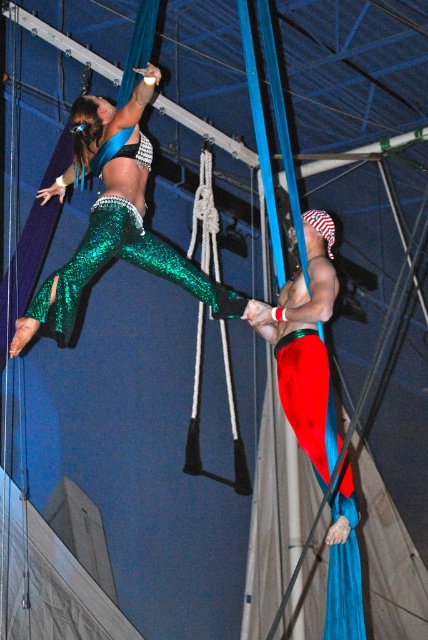
You are a photographer capturing the aerial performance. You notice the shiny green sequined pants at center and the red fabric pants at center. Which pair of pants appears to be higher in the image?

The shiny green sequined pants at center is positioned over red fabric pants at center, so it appears higher in the image.

You are a photographer capturing the aerial performance. You notice two performers wearing shiny green sequined pants at center and red fabric pants at center. Which performer is positioned to the left side of the other?

The shiny green sequined pants at center are to the left of the red fabric pants at center.

You are designing a new performance costume and need to ensure that the shiny green sequined pants at center and the red fabric pants at center can be easily distinguished from a distance. Based on the description provided, which pair of pants is wider?

The shiny green sequined pants at center might be wider than red fabric pants at center according to the description provided.